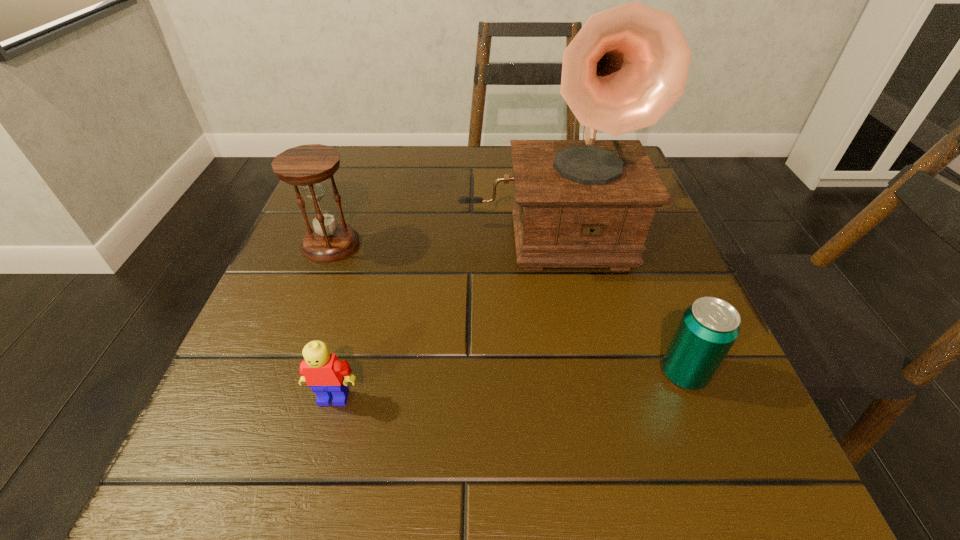
Image resolution: width=960 pixels, height=540 pixels. In order to click on object that is the third closest one to the hourglass in this screenshot , I will do `click(709, 327)`.

Where is `free space in the image that satisfies the following two spatial constraints: 1. on the horn of the beer can; 2. on the right side of the record player`? The height and width of the screenshot is (540, 960). free space in the image that satisfies the following two spatial constraints: 1. on the horn of the beer can; 2. on the right side of the record player is located at coordinates (567, 374).

At what (x,y) coordinates should I click in order to perform the action: click on vacant space that satisfies the following two spatial constraints: 1. on the horn of the record player; 2. on the right side of the beer can. Please return your answer as a coordinate pair (x, y). This screenshot has height=540, width=960. Looking at the image, I should click on (567, 374).

The height and width of the screenshot is (540, 960). Identify the location of vacant area that satisfies the following two spatial constraints: 1. on the horn of the tallest object; 2. on the right side of the beer can. (567, 374).

You are a GUI agent. You are given a task and a screenshot of the screen. Output one action in this format:
    pyautogui.click(x=<x>, y=<y>)
    Task: Click on the vacant space that satisfies the following two spatial constraints: 1. on the horn of the tallest object; 2. on the left side of the beer can
    This screenshot has width=960, height=540.
    Given the screenshot: What is the action you would take?
    pyautogui.click(x=567, y=374)

In order to click on vacant area in the image that satisfies the following two spatial constraints: 1. on the horn of the beer can; 2. on the right side of the tallest object in this screenshot , I will do `click(567, 374)`.

Identify the location of vacant space that satisfies the following two spatial constraints: 1. on the horn of the record player; 2. on the right side of the beer can. (567, 374).